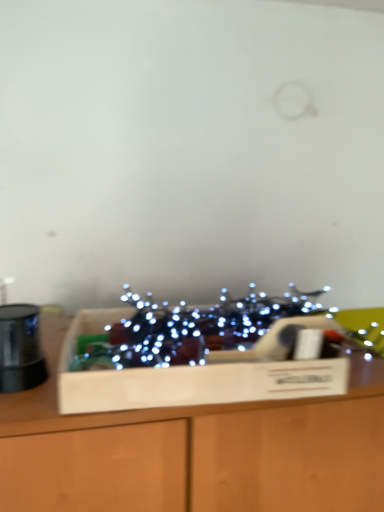
Question: Can you confirm if illuminated string lights at center is taller than wooden box at center?

Choices:
 (A) no
 (B) yes

Answer: (B)

Question: Is illuminated string lights at center to the right of wooden box at center from the viewer's perspective?

Choices:
 (A) no
 (B) yes

Answer: (B)

Question: Is illuminated string lights at center positioned beyond the bounds of wooden box at center?

Choices:
 (A) no
 (B) yes

Answer: (B)

Question: Is illuminated string lights at center thinner than wooden box at center?

Choices:
 (A) no
 (B) yes

Answer: (A)

Question: Considering the relative sizes of illuminated string lights at center and wooden box at center in the image provided, is illuminated string lights at center shorter than wooden box at center?

Choices:
 (A) no
 (B) yes

Answer: (A)

Question: Would you say illuminated string lights at center is a long distance from wooden box at center?

Choices:
 (A) no
 (B) yes

Answer: (A)

Question: Could you tell me if wooden box at center is facing wooden box at center?

Choices:
 (A) yes
 (B) no

Answer: (B)

Question: Could wooden box at center be considered to be inside wooden box at center?

Choices:
 (A) no
 (B) yes

Answer: (A)

Question: Is wooden box at center completely or partially outside of wooden box at center?

Choices:
 (A) yes
 (B) no

Answer: (A)

Question: Is wooden box at center looking in the opposite direction of wooden box at center?

Choices:
 (A) no
 (B) yes

Answer: (A)

Question: Considering the relative positions of wooden box at center and wooden box at center in the image provided, is wooden box at center to the right of wooden box at center from the viewer's perspective?

Choices:
 (A) yes
 (B) no

Answer: (B)

Question: Is wooden box at center far away from wooden box at center?

Choices:
 (A) yes
 (B) no

Answer: (B)

Question: Is wooden box at center positioned far away from wooden box at center?

Choices:
 (A) no
 (B) yes

Answer: (A)